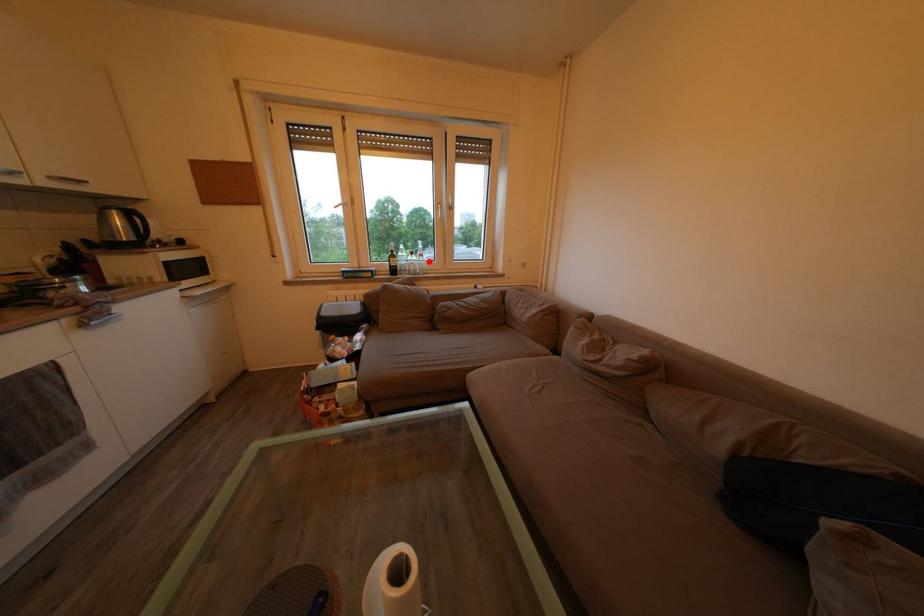
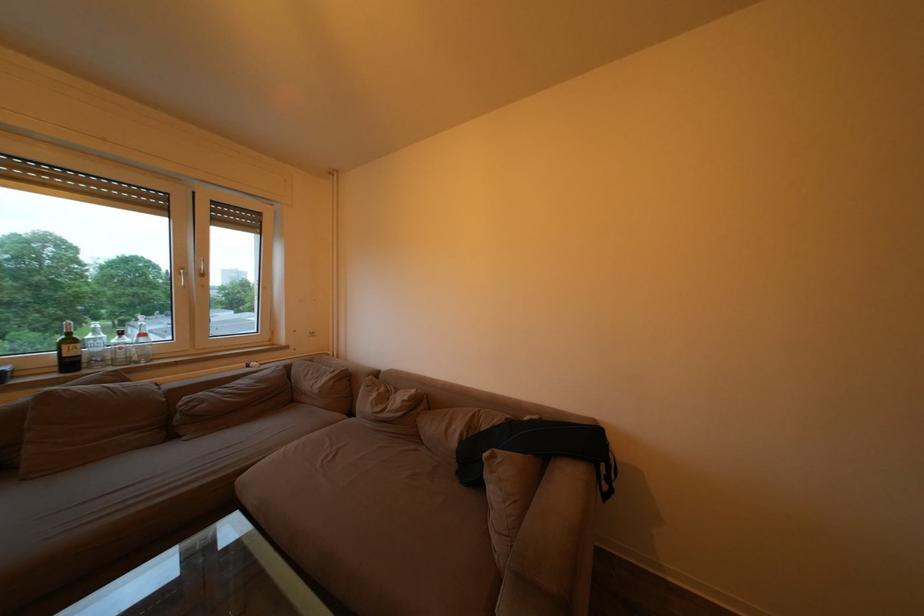
Question: I am providing you with two images of the same scene from different viewpoints. Given a red point in image1, look at the same physical point in image2. Is it:

Choices:
 (A) Closer to the viewpoint
 (B) Farther from the viewpoint

Answer: (B)